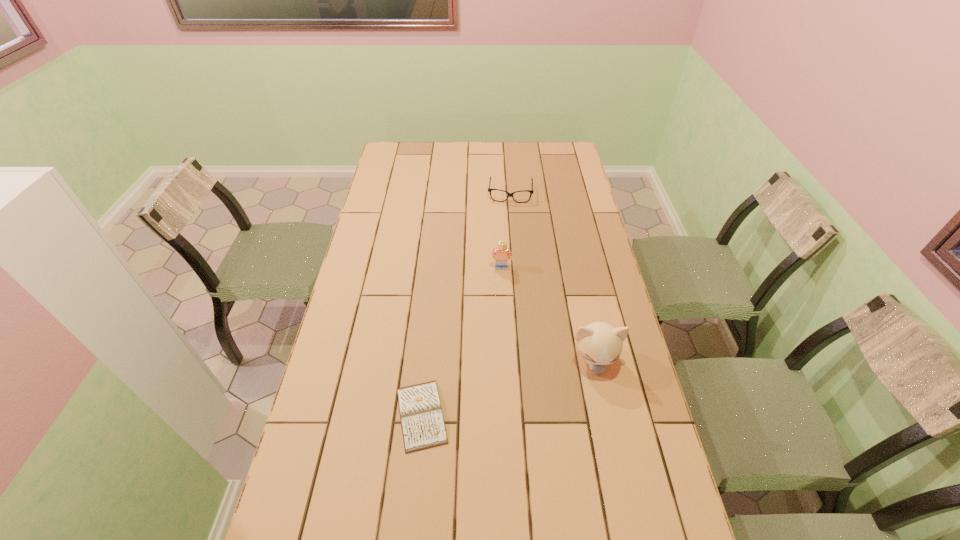
Identify the location of unoccupied area between the rightmost object and the second farthest object. (547, 314).

What are the coordinates of `vacant space that's between the diary and the farthest object` in the screenshot? It's located at (466, 304).

I want to click on unoccupied position between the kitten and the diary, so click(508, 388).

Where is `object that is the closest to the third shortest object`? This screenshot has width=960, height=540. object that is the closest to the third shortest object is located at coordinates (599, 343).

You are a GUI agent. You are given a task and a screenshot of the screen. Output one action in this format:
    pyautogui.click(x=<x>, y=<y>)
    Task: Click on the object that is the second nearest to the second farthest object
    The width and height of the screenshot is (960, 540).
    Given the screenshot: What is the action you would take?
    pyautogui.click(x=489, y=189)

At what (x,y) coordinates should I click in order to perform the action: click on blank space that satisfies the following two spatial constraints: 1. on the back side of the Lego; 2. on the left side of the third tallest object. Please return your answer as a coordinate pair (x, y). This screenshot has height=540, width=960. Looking at the image, I should click on (497, 193).